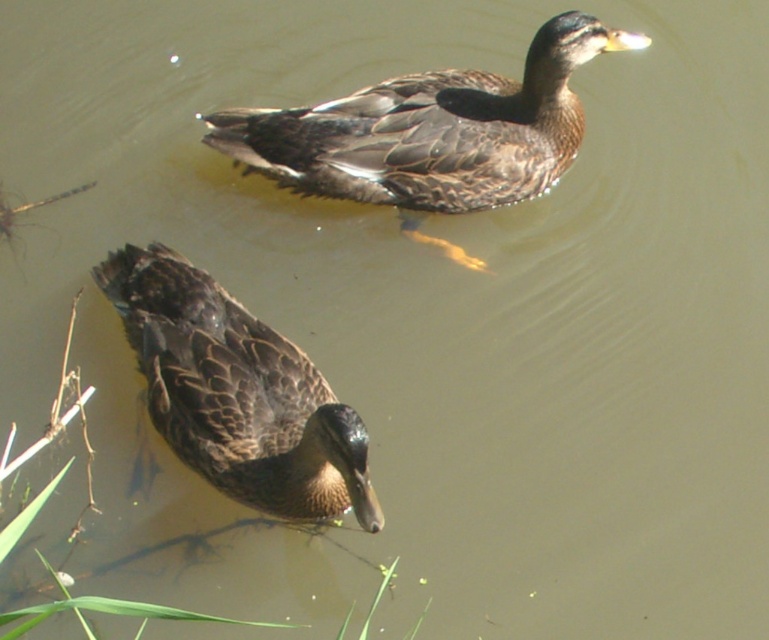
You are a birdwatcher observing the two ducks in the scene. Which duck has a larger width between the brown feathered duck at upper center and the dark brown feathers at lower left?

The brown feathered duck at upper center has a larger width than the dark brown feathers at lower left.

You are a wildlife photographer trying to capture a closeup shot of the brown feathered duck at upper center and the dark brown feathers at lower left. Your camera has a minimum focus distance of 28 inches. Can you focus on both subjects simultaneously without moving your position?

The distance between the brown feathered duck at upper center and the dark brown feathers at lower left is 28.52 inches. Since your camera can focus as close as 28 inches, you can focus on both subjects at the same time because the distance is within the camera s minimum focus range.

Based on the photo, you are a photographer trying to capture a closeup of the brown feathered duck at upper center. Based on its 2D coordinates, which part of the image should you focus on?

The brown feathered duck at upper center is located at the 2D coordinates point (431,131), so you should focus on the upper center part of the image.